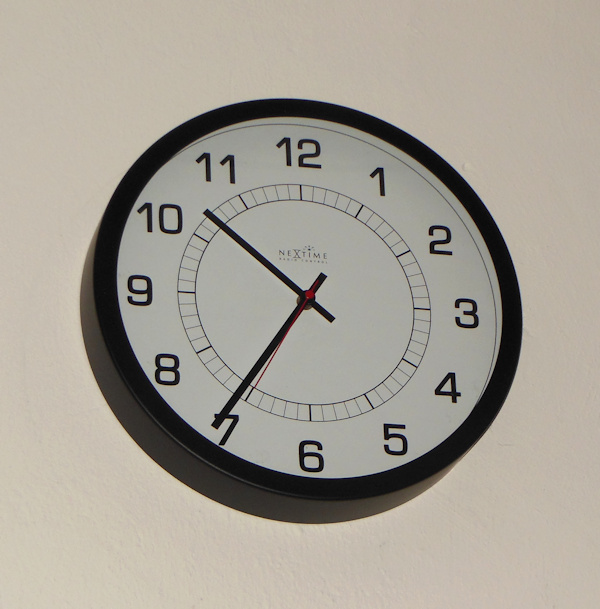
I want to click on clock, so pos(247,170).